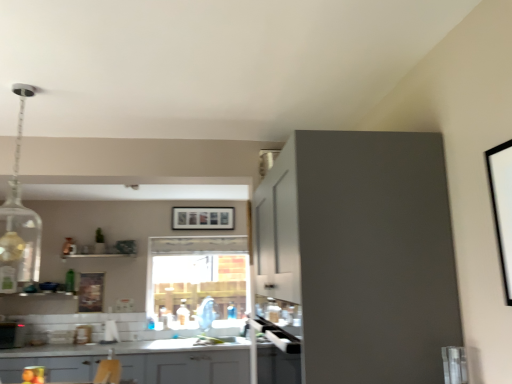
This screenshot has height=384, width=512. In order to click on vacant space in matte black picture frame at center, the 2th picture frame from the bottom (from a real-world perspective) in this screenshot , I will do [206, 336].